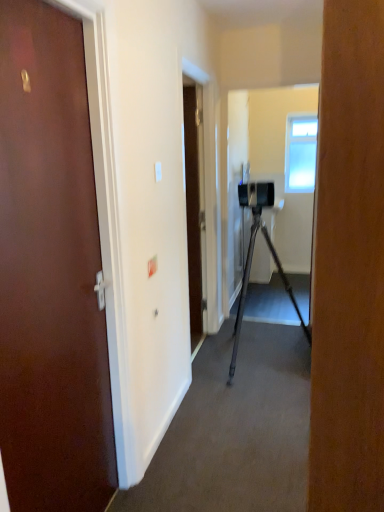
Question: Is clear glass window at upper center closer to the viewer compared to matte brown door at left?

Choices:
 (A) yes
 (B) no

Answer: (B)

Question: From the image's perspective, would you say clear glass window at upper center is shown under matte brown door at left?

Choices:
 (A) yes
 (B) no

Answer: (B)

Question: Is matte brown door at left inside clear glass window at upper center?

Choices:
 (A) no
 (B) yes

Answer: (A)

Question: Considering the relative sizes of clear glass window at upper center and matte brown door at left in the image provided, is clear glass window at upper center taller than matte brown door at left?

Choices:
 (A) yes
 (B) no

Answer: (B)

Question: Is clear glass window at upper center located outside matte brown door at left?

Choices:
 (A) no
 (B) yes

Answer: (B)

Question: Does clear glass window at upper center have a larger size compared to matte brown door at left?

Choices:
 (A) no
 (B) yes

Answer: (A)

Question: Is matte brown door at left to the right of clear glass window at upper center from the viewer's perspective?

Choices:
 (A) yes
 (B) no

Answer: (B)

Question: Is matte brown door at left completely or partially outside of clear glass window at upper center?

Choices:
 (A) no
 (B) yes

Answer: (B)

Question: Does matte brown door at left turn towards clear glass window at upper center?

Choices:
 (A) yes
 (B) no

Answer: (B)

Question: Considering the relative sizes of matte brown door at left and clear glass window at upper center in the image provided, is matte brown door at left taller than clear glass window at upper center?

Choices:
 (A) yes
 (B) no

Answer: (A)

Question: From the image's perspective, does matte brown door at left appear lower than clear glass window at upper center?

Choices:
 (A) yes
 (B) no

Answer: (A)

Question: From the image's perspective, is matte brown door at left over clear glass window at upper center?

Choices:
 (A) yes
 (B) no

Answer: (B)

Question: Is matte brown door at left taller or shorter than clear glass window at upper center?

Choices:
 (A) short
 (B) tall

Answer: (B)